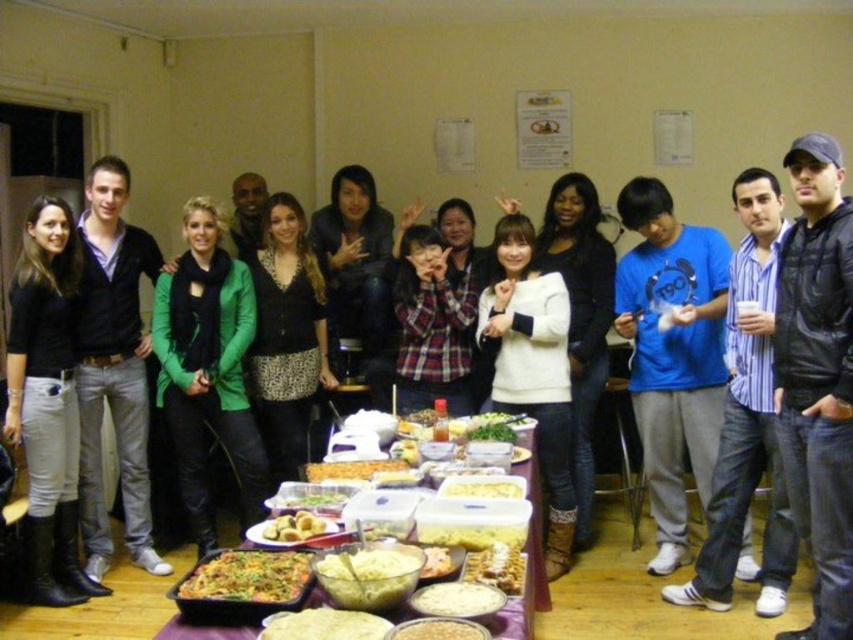
Consider the image. You are standing at the position of the matte black boots at lower left and want to reach the door located 3.17 meters away. Is the distance sufficient to walk to the door without any obstacles?

The matte black boots at lower left are 3.17 meters away from the door, so yes, the distance is sufficient to walk to the door without any obstacles.

Based on the photo, you are a photographer trying to position a yellow matte casserole at center for a photo. The camera is set up at point A, which is at coordinates 0.7, 0.6. To ensure the casserole is centered in the frame, should you move it to the left or right?

The yellow matte casserole at center is located at coordinates (471, 534). The camera is at (511, 448). To center the casserole in the frame, move it to the left since its current X coordinate is higher than the camera X coordinate.

You are a photographer trying to capture a closeup of the yellow matte casserole at center and the green leafy vegetables at center. Given that your camera can focus on objects within a 10 inch range, can you fit both items in the same frame without moving the camera?

The distance between the yellow matte casserole at center and the green leafy vegetables at center is 15.48 inches. Since your camera can only focus within a 10 inch range, you cannot fit both items in the same frame without moving the camera.